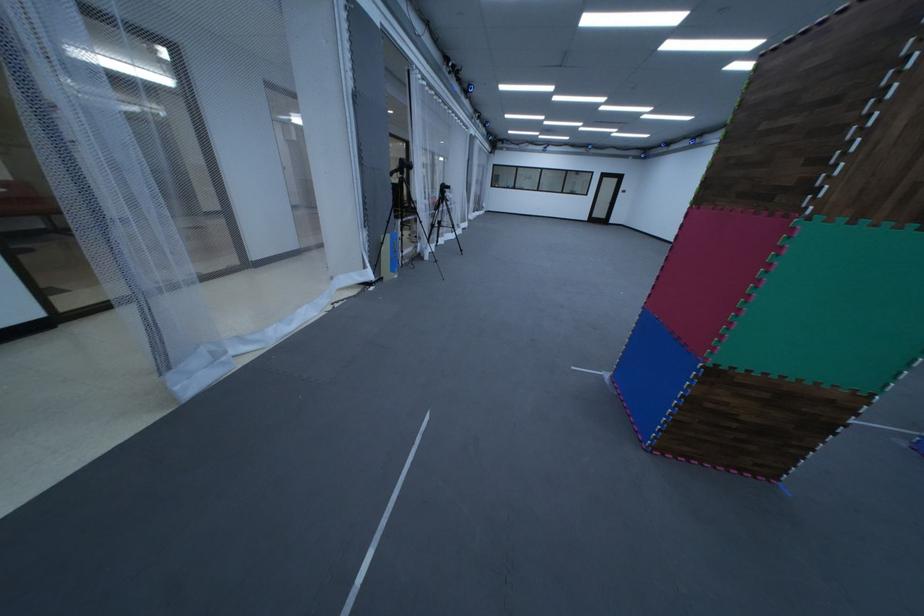
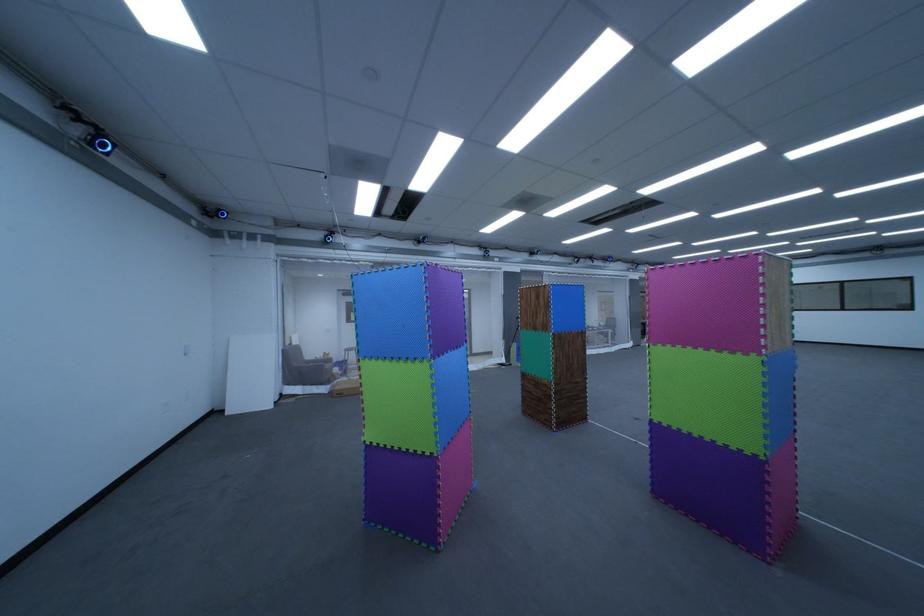
Find the pixel in the second image that matches (x=487, y=137) in the first image.

(647, 281)